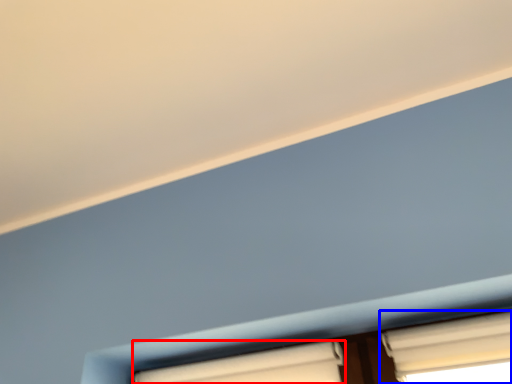
Question: Which of the following is the closest to the observer, window (highlighted by a red box) or window (highlighted by a blue box)?

Choices:
 (A) window
 (B) window

Answer: (B)